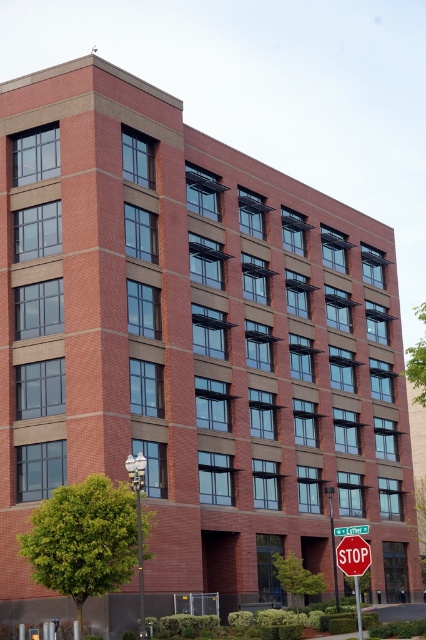
Question: Can you confirm if red plastic stop sign at center is positioned to the left of green plastic street sign at upper center?

Choices:
 (A) yes
 (B) no

Answer: (A)

Question: Observing the image, what is the correct spatial positioning of red plastic stop sign at center in reference to green plastic street sign at upper center?

Choices:
 (A) right
 (B) left

Answer: (B)

Question: Is red plastic stop sign at center above green plastic street sign at upper center?

Choices:
 (A) no
 (B) yes

Answer: (B)

Question: Which point is farther to the camera?

Choices:
 (A) (347, 554)
 (B) (356, 531)

Answer: (B)

Question: Which object is farther from the camera taking this photo?

Choices:
 (A) green plastic street sign at upper center
 (B) red plastic stop sign at center

Answer: (A)